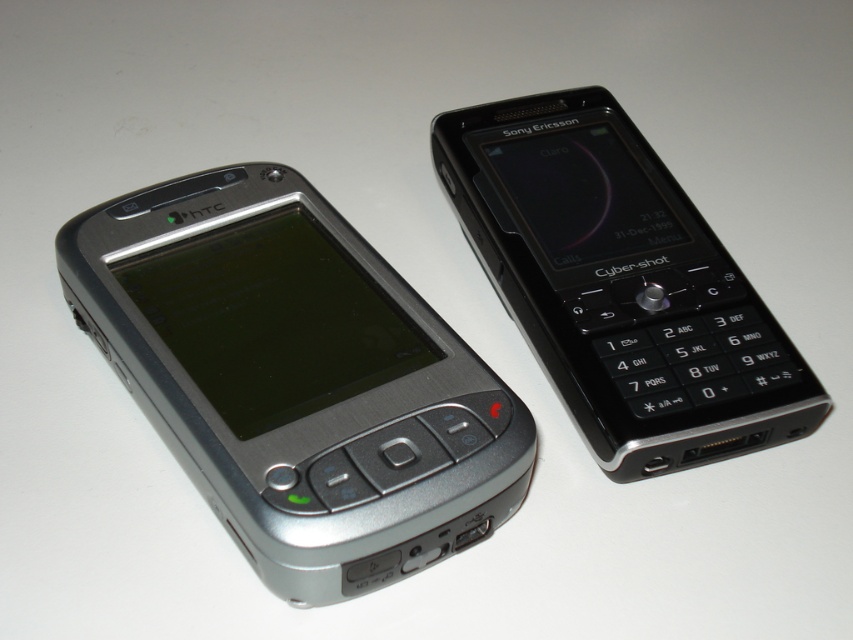
Which is more to the right, silver metallic smartphone at left or black glossy sony ericsson cyber-shot at right?

black glossy sony ericsson cyber-shot at right

Does point (265, 444) lie behind point (587, 416)?

That is False.

Identify the location of silver metallic smartphone at left. This screenshot has height=640, width=853. (296, 378).